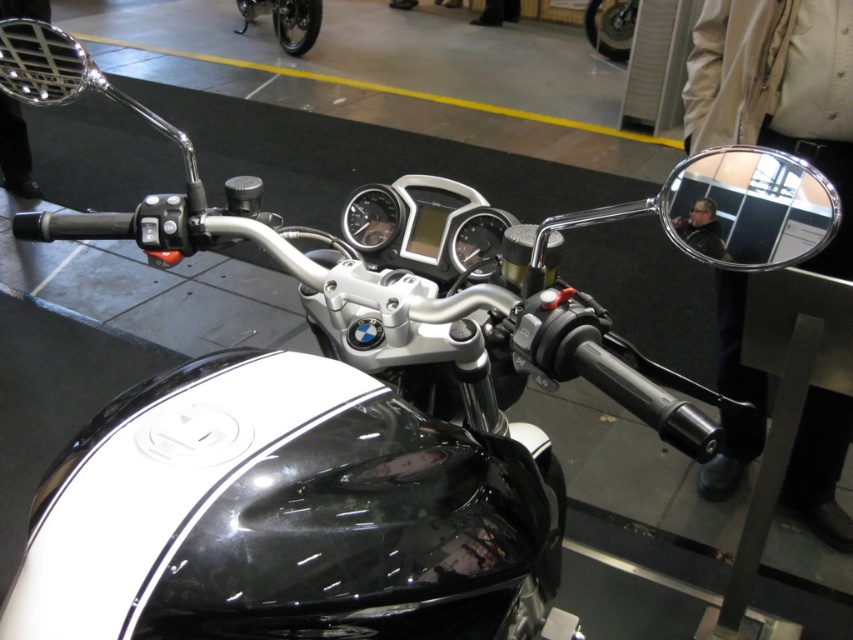
Question: Which point appears closest to the camera in this image?

Choices:
 (A) (785, 221)
 (B) (621, 44)
 (C) (287, 26)

Answer: (A)

Question: Is the position of shiny chrome motorcycle at upper center more distant than that of black glossy motorcycle at center?

Choices:
 (A) yes
 (B) no

Answer: (A)

Question: Which is farther from the shiny chrome motorcycle at upper center?

Choices:
 (A) chrome/metallic view mirror at right
 (B) black glossy motorcycle at center

Answer: (A)

Question: Is the position of chrome/metallic view mirror at right less distant than that of black glossy motorcycle at center?

Choices:
 (A) yes
 (B) no

Answer: (A)

Question: Can you confirm if chrome/metallic view mirror at right is positioned above black glossy motorcycle at center?

Choices:
 (A) no
 (B) yes

Answer: (A)

Question: Which point appears closest to the camera in this image?

Choices:
 (A) (607, 8)
 (B) (248, 12)
 (C) (804, 182)

Answer: (C)